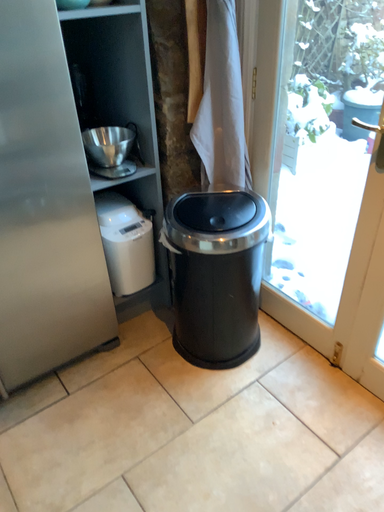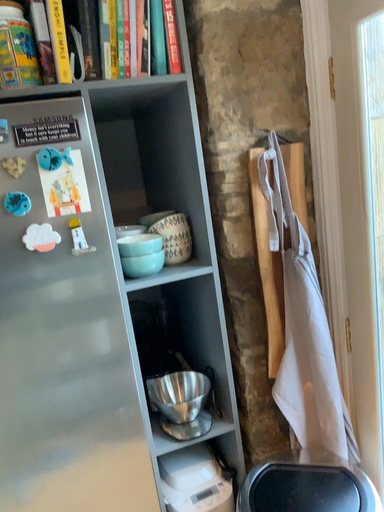
Question: Which way did the camera rotate in the video?

Choices:
 (A) rotated left
 (B) rotated right

Answer: (A)